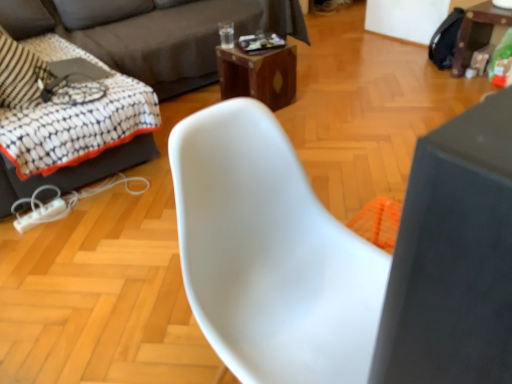
In order to face woodenmaterial/texturetable at center, which appears as the 1th table when viewed from the left, should I rotate leftwards or rightwards?

Turn right approximately 0.198 degrees to face it.

How much space does dark gray fabric couch at upper left, which is counted as the 2th studio couch, starting from the right, occupy vertically?

It is 32.69 inches.

Identify the location of white plastic swivel chair at left. The width and height of the screenshot is (512, 384). (81, 141).

What are the coordinates of `the 2nd table behind the white plastic chair at center` in the screenshot? It's located at point(477,32).

From the picture: Is wooden table at right, the first table viewed from the right, bigger than white plastic chair at center?

Actually, wooden table at right, the first table viewed from the right, might be smaller than white plastic chair at center.

Does wooden table at right, the 2th table positioned from the left, lie behind white plastic chair at center?

Yes.

Looking at this image, from a real-world perspective, between wooden table at right, the 2th table positioned from the left, and white plastic chair at center, who is vertically lower?

wooden table at right, the 2th table positioned from the left, from a real-world perspective.

Can you tell me how much white plastic swivel chair at left and dark gray fabric couch at upper left, which appears as the 1th studio couch when viewed from the right, differ in facing direction?

white plastic swivel chair at left and dark gray fabric couch at upper left, which appears as the 1th studio couch when viewed from the right, are facing 91.6 degrees away from each other.

Which of these two, white plastic swivel chair at left or dark gray fabric couch at upper left, placed as the second studio couch when sorted from left to right, is wider?

dark gray fabric couch at upper left, placed as the second studio couch when sorted from left to right, is wider.

From the image's perspective, between white plastic swivel chair at left and dark gray fabric couch at upper left, which appears as the 1th studio couch when viewed from the right, which one is located above?

dark gray fabric couch at upper left, which appears as the 1th studio couch when viewed from the right, from the image's perspective.

Is point (83, 124) positioned behind point (190, 55)?

No, it is not.

Based on the photo, from the image's perspective, is dark gray fabric couch at upper left, which appears as the 1th studio couch when viewed from the right, above or below dark gray fabric couch at upper left, positioned as the first studio couch in left-to-right order?

dark gray fabric couch at upper left, which appears as the 1th studio couch when viewed from the right, is situated higher than dark gray fabric couch at upper left, positioned as the first studio couch in left-to-right order, in the image.

Based on their positions, is dark gray fabric couch at upper left, which appears as the 1th studio couch when viewed from the right, located to the left or right of dark gray fabric couch at upper left, positioned as the first studio couch in left-to-right order?

In the image, dark gray fabric couch at upper left, which appears as the 1th studio couch when viewed from the right, appears on the right side of dark gray fabric couch at upper left, positioned as the first studio couch in left-to-right order.

Could you tell me if dark gray fabric couch at upper left, placed as the second studio couch when sorted from left to right, is facing dark gray fabric couch at upper left, which is counted as the 2th studio couch, starting from the right?

Yes, dark gray fabric couch at upper left, placed as the second studio couch when sorted from left to right, is aimed at dark gray fabric couch at upper left, which is counted as the 2th studio couch, starting from the right.

Is dark gray fabric couch at upper left, which appears as the 1th studio couch when viewed from the right, not within dark gray fabric couch at upper left, positioned as the first studio couch in left-to-right order?

No.

From a real-world perspective, is dark gray fabric couch at upper left, which is counted as the 2th studio couch, starting from the right, physically below wooden table at right, the first table viewed from the right?

No, from a real-world perspective, dark gray fabric couch at upper left, which is counted as the 2th studio couch, starting from the right, is not under wooden table at right, the first table viewed from the right.

How distant is dark gray fabric couch at upper left, positioned as the first studio couch in left-to-right order, from wooden table at right, the first table viewed from the right?

A distance of 1.63 meters exists between dark gray fabric couch at upper left, positioned as the first studio couch in left-to-right order, and wooden table at right, the first table viewed from the right.

Who is smaller, dark gray fabric couch at upper left, which is counted as the 2th studio couch, starting from the right, or wooden table at right, the first table viewed from the right?

wooden table at right, the first table viewed from the right.

Between dark gray fabric couch at upper left, which is counted as the 2th studio couch, starting from the right, and wooden table at right, the first table viewed from the right, which one has less height?

With less height is wooden table at right, the first table viewed from the right.

Considering the points (336, 350) and (17, 180), which point is behind, point (336, 350) or point (17, 180)?

The point (17, 180) is farther.

Are white plastic chair at center and white plastic swivel chair at left located far from each other?

Absolutely, white plastic chair at center is distant from white plastic swivel chair at left.

How different are the orientations of white plastic chair at center and white plastic swivel chair at left in degrees?

92.2 degrees.

Is white plastic swivel chair at left inside white plastic chair at center?

Definitely not — white plastic swivel chair at left is not inside white plastic chair at center.

Can you confirm if white plastic chair at center is thinner than dark gray fabric couch at upper left, positioned as the first studio couch in left-to-right order?

Yes, white plastic chair at center is thinner than dark gray fabric couch at upper left, positioned as the first studio couch in left-to-right order.

From a real-world perspective, relative to dark gray fabric couch at upper left, positioned as the first studio couch in left-to-right order, is white plastic chair at center vertically above or below?

In terms of real-world spatial position, white plastic chair at center is below dark gray fabric couch at upper left, positioned as the first studio couch in left-to-right order.

You are a GUI agent. You are given a task and a screenshot of the screen. Output one action in this format:
    pyautogui.click(x=<x>, y=<y>)
    Task: Click on the 1st studio couch behind the white plastic chair at center
    Image resolution: width=512 pixels, height=384 pixels.
    Given the screenshot: What is the action you would take?
    pyautogui.click(x=155, y=33)

In the scene shown: From the image's perspective, between white plastic swivel chair at left and dark gray fabric couch at upper left, positioned as the first studio couch in left-to-right order, who is located below?

white plastic swivel chair at left is shown below in the image.

Who is bigger, white plastic swivel chair at left or dark gray fabric couch at upper left, positioned as the first studio couch in left-to-right order?

With larger size is dark gray fabric couch at upper left, positioned as the first studio couch in left-to-right order.

Is dark gray fabric couch at upper left, positioned as the first studio couch in left-to-right order, at the back of white plastic swivel chair at left?

Yes, dark gray fabric couch at upper left, positioned as the first studio couch in left-to-right order, is at the back of white plastic swivel chair at left.

Who is more distant, white plastic swivel chair at left or dark gray fabric couch at upper left, which is counted as the 2th studio couch, starting from the right?

white plastic swivel chair at left.

Find the location of a particular element. Image resolution: width=512 pixels, height=384 pixels. the 2nd table above when counting from the white plastic chair at center (from the image's perspective) is located at coordinates (477, 32).

At what (x,y) coordinates should I click in order to perform the action: click on studio couch behind the white plastic swivel chair at left. Please return your answer as a coordinate pair (x, y). The height and width of the screenshot is (384, 512). Looking at the image, I should click on click(153, 32).

Considering their positions, is wooden table at right, the first table viewed from the right, positioned closer to white plastic swivel chair at left than woodenmaterial/texturetable at center, which is counted as the 2th table, starting from the right?

woodenmaterial/texturetable at center, which is counted as the 2th table, starting from the right.

Looking at the image, which one is located further to woodenmaterial/texturetable at center, which is counted as the 2th table, starting from the right, white plastic swivel chair at left or wooden table at right, the 2th table positioned from the left?

Among the two, wooden table at right, the 2th table positioned from the left, is located further to woodenmaterial/texturetable at center, which is counted as the 2th table, starting from the right.

Based on their spatial positions, is white plastic chair at center or white plastic swivel chair at left closer to dark gray fabric couch at upper left, positioned as the first studio couch in left-to-right order?

white plastic swivel chair at left lies closer to dark gray fabric couch at upper left, positioned as the first studio couch in left-to-right order, than the other object.

Based on their spatial positions, is white plastic chair at center or dark gray fabric couch at upper left, placed as the second studio couch when sorted from left to right, further from wooden table at right, the first table viewed from the right?

white plastic chair at center is further to wooden table at right, the first table viewed from the right.

Estimate the real-world distances between objects in this image. Which object is closer to wooden table at right, the first table viewed from the right, white plastic swivel chair at left or dark gray fabric couch at upper left, positioned as the first studio couch in left-to-right order?

dark gray fabric couch at upper left, positioned as the first studio couch in left-to-right order, is positioned closer to the anchor wooden table at right, the first table viewed from the right.

In the scene shown: Estimate the real-world distances between objects in this image. Which object is further from woodenmaterial/texturetable at center, which appears as the 1th table when viewed from the left, wooden table at right, the first table viewed from the right, or white plastic chair at center?

Based on the image, white plastic chair at center appears to be further to woodenmaterial/texturetable at center, which appears as the 1th table when viewed from the left.

Which object lies further to the anchor point white plastic chair at center, woodenmaterial/texturetable at center, which appears as the 1th table when viewed from the left, or white plastic swivel chair at left?

The object further to white plastic chair at center is woodenmaterial/texturetable at center, which appears as the 1th table when viewed from the left.

From the image, which object appears to be farther from white plastic swivel chair at left, dark gray fabric couch at upper left, positioned as the first studio couch in left-to-right order, or dark gray fabric couch at upper left, which appears as the 1th studio couch when viewed from the right?

Based on the image, dark gray fabric couch at upper left, which appears as the 1th studio couch when viewed from the right, appears to be further to white plastic swivel chair at left.

I want to click on swivel chair between dark gray fabric couch at upper left, which is counted as the 2th studio couch, starting from the right, and white plastic chair at center in the up-down direction, so click(81, 141).

Locate an element on the screen. The height and width of the screenshot is (384, 512). studio couch between dark gray fabric couch at upper left, which is counted as the 2th studio couch, starting from the right, and wooden table at right, the first table viewed from the right is located at coordinates (153, 32).

Find the location of `swivel chair between white plastic chair at center and woodenmaterial/texturetable at center, which appears as the 1th table when viewed from the left, from front to back`. swivel chair between white plastic chair at center and woodenmaterial/texturetable at center, which appears as the 1th table when viewed from the left, from front to back is located at coordinates pyautogui.click(x=81, y=141).

Where is `chair situated between dark gray fabric couch at upper left, placed as the second studio couch when sorted from left to right, and wooden table at right, the first table viewed from the right, from left to right`? The height and width of the screenshot is (384, 512). chair situated between dark gray fabric couch at upper left, placed as the second studio couch when sorted from left to right, and wooden table at right, the first table viewed from the right, from left to right is located at coordinates (270, 254).